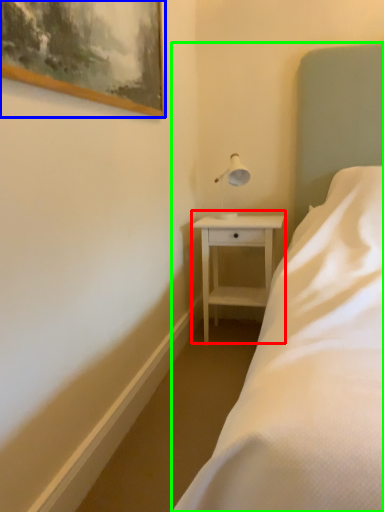
Question: Which is farther away from nightstand (highlighted by a red box)? picture frame (highlighted by a blue box) or bed (highlighted by a green box)?

Choices:
 (A) picture frame
 (B) bed

Answer: (A)